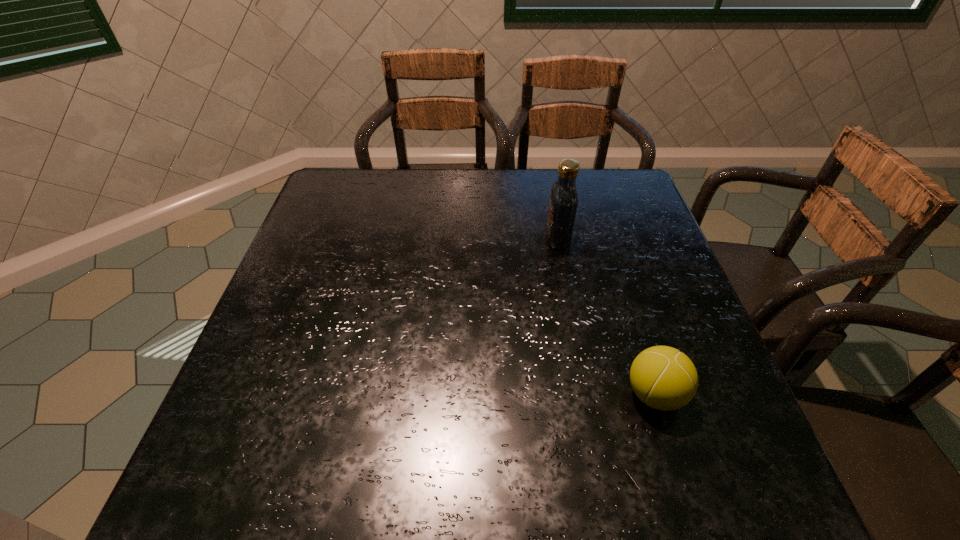
Locate an element on the screen. This screenshot has height=540, width=960. the taller object is located at coordinates (563, 203).

Where is `vodka`? The width and height of the screenshot is (960, 540). vodka is located at coordinates (563, 203).

I want to click on the shorter object, so click(x=664, y=378).

Find the location of a particular element. the right object is located at coordinates (664, 378).

Locate an element on the screen. This screenshot has height=540, width=960. free space located 0.360m on the front-facing side of the taller object is located at coordinates (409, 238).

Where is `free spot located 0.260m on the front-facing side of the taller object`? The width and height of the screenshot is (960, 540). free spot located 0.260m on the front-facing side of the taller object is located at coordinates (447, 238).

The width and height of the screenshot is (960, 540). In order to click on vacant space located on the front-facing side of the taller object in this screenshot , I will do `click(444, 238)`.

At what (x,y) coordinates should I click in order to perform the action: click on vacant space located on the left of the right object. Please return your answer as a coordinate pair (x, y). Looking at the image, I should click on (524, 394).

Where is `object present at the right edge`? object present at the right edge is located at coordinates (664, 378).

Identify the location of free location at the far edge. (448, 169).